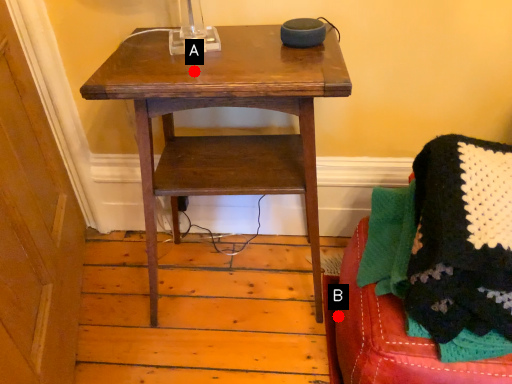
Question: Two points are circled on the image, labeled by A and B beside each circle. Which point is further to the camera?

Choices:
 (A) A is further
 (B) B is further

Answer: (B)